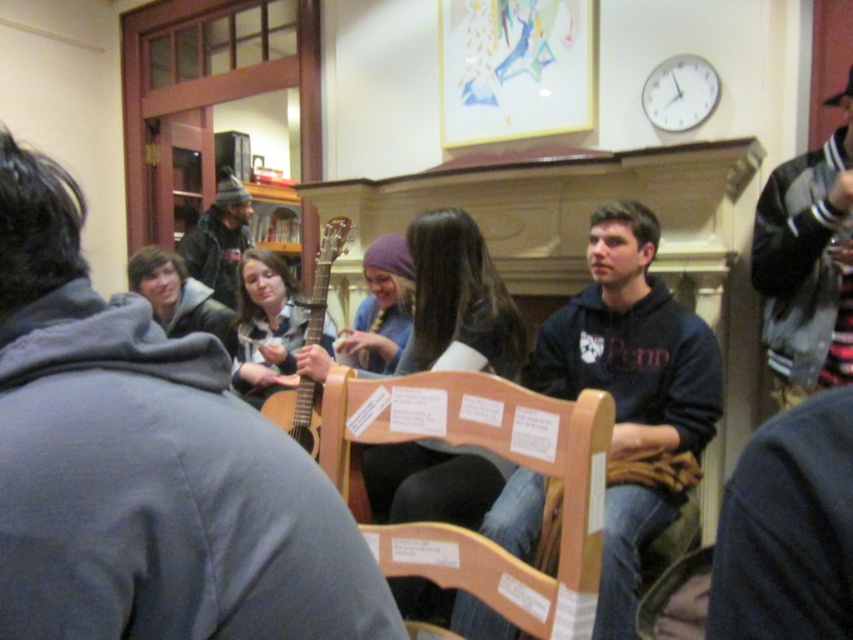
You are organizing a small indoor event and need to place a 10 feet long table between the wooden chair at center and the dark gray knit hat at upper left. Is there enough space to fit the table between them?

The distance between the wooden chair at center and the dark gray knit hat at upper left is 9.43 feet, which is less than the 10 feet required for the table. Therefore, there isn not enough space to fit the table between them.

You are standing at the entrance of the room and see the dark blue hoodie at center. If you walk straight towards the hoodie, will you encounter any obstacles in your path?

The dark blue hoodie at center is located at point (633, 394), so walking straight towards it from the entrance might not be possible due to the arrangement of the chairs in a semi circle. You may need to navigate around the chairs to reach it.

You are standing in the room and want to place a small plant between the two points, point (x=368, y=410) and point (x=223, y=173). Which point should the plant be closer to in order to be nearer to the camera?

The plant should be placed closer to point (x=368, y=410) because it is closer to the camera than point (x=223, y=173).